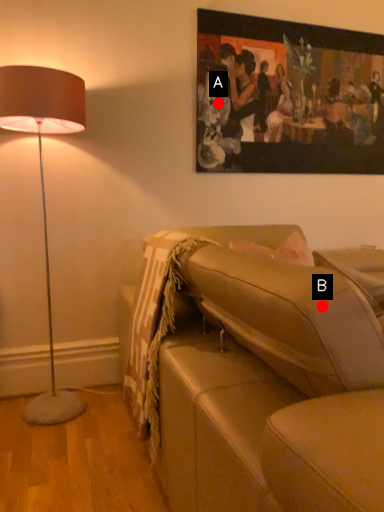
Question: Two points are circled on the image, labeled by A and B beside each circle. Among these points, which one is farthest from the camera?

Choices:
 (A) A is further
 (B) B is further

Answer: (A)